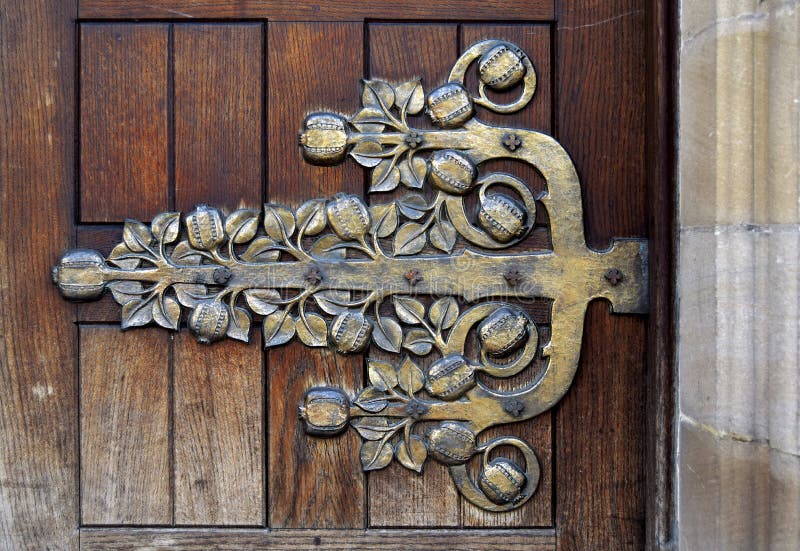
The width and height of the screenshot is (800, 551). I want to click on bottom of candletick, so 613,248.